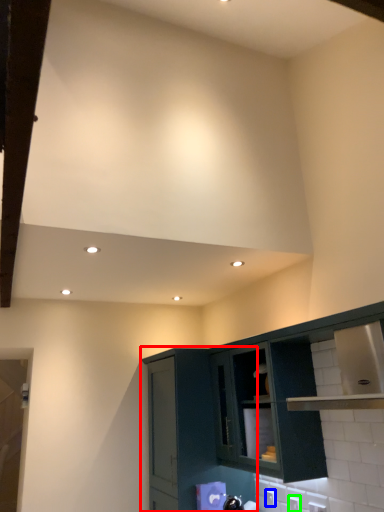
Question: Based on their relative distances, which object is nearer to cabinetry (highlighted by a red box)? Choose from electric outlet (highlighted by a blue box) and electric outlet (highlighted by a green box).

Choices:
 (A) electric outlet
 (B) electric outlet

Answer: (A)